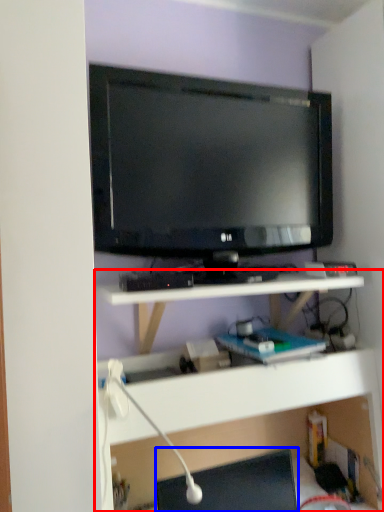
Question: Which point is further to the camera, shelf (highlighted by a red box) or desktop (highlighted by a blue box)?

Choices:
 (A) shelf
 (B) desktop

Answer: (B)